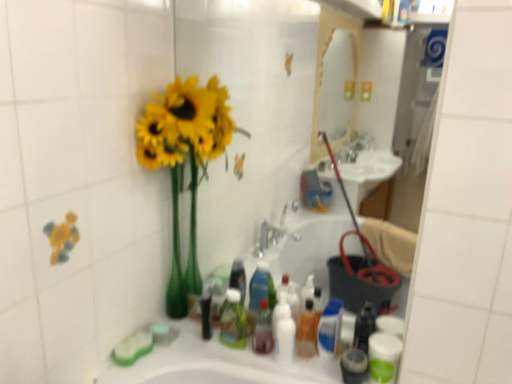
Locate an element on the screen. This screenshot has width=512, height=384. translucent plastic mouthwash at center, placed as the third mouthwash when sorted from right to left is located at coordinates (330, 328).

What do you see at coordinates (284, 334) in the screenshot?
I see `white glossy bottle at center, arranged as the 2th toiletry when viewed from the right` at bounding box center [284, 334].

This screenshot has height=384, width=512. I want to click on translucent plastic bottle at center, arranged as the first toiletry when viewed from the left, so click(233, 320).

The width and height of the screenshot is (512, 384). What do you see at coordinates (383, 356) in the screenshot? I see `white glossy mouthwash at lower right, marked as the first mouthwash in a right-to-left arrangement` at bounding box center [383, 356].

The image size is (512, 384). What do you see at coordinates (307, 331) in the screenshot?
I see `translucent plastic soap dispenser at center, the first toiletry from the right` at bounding box center [307, 331].

Find the location of a particular element. translucent plastic mouthwash at center, which is the second mouthwash in left-to-right order is located at coordinates (330, 328).

From a real-world perspective, between translucent plastic mouthwash at center, placed as the 4th mouthwash when sorted from right to left, and translucent plastic mouthwash at center, placed as the third mouthwash when sorted from right to left, who is vertically lower?

translucent plastic mouthwash at center, placed as the third mouthwash when sorted from right to left, is physically lower.

Consider the image. Is translucent plastic mouthwash at center, placed as the 4th mouthwash when sorted from right to left, inside the boundaries of translucent plastic mouthwash at center, placed as the third mouthwash when sorted from right to left, or outside?

translucent plastic mouthwash at center, placed as the 4th mouthwash when sorted from right to left, is spatially situated outside translucent plastic mouthwash at center, placed as the third mouthwash when sorted from right to left.

Which of these two, translucent plastic mouthwash at center, placed as the 4th mouthwash when sorted from right to left, or translucent plastic mouthwash at center, placed as the third mouthwash when sorted from right to left, is wider?

translucent plastic mouthwash at center, placed as the 4th mouthwash when sorted from right to left.

Between translucent plastic mouthwash at center, placed as the 4th mouthwash when sorted from right to left, and translucent plastic mouthwash at center, placed as the third mouthwash when sorted from right to left, which one is positioned in front?

translucent plastic mouthwash at center, placed as the 4th mouthwash when sorted from right to left, is in front.

Does point (256, 330) appear closer or farther from the camera than point (357, 351)?

Point (256, 330) is positioned farther from the camera compared to point (357, 351).

Can we say translucent plastic mouthwash at center, placed as the 4th mouthwash when sorted from right to left, lies outside translucent plastic mouthwash at lower right, the 2th mouthwash viewed from the right?

Yes, translucent plastic mouthwash at center, placed as the 4th mouthwash when sorted from right to left, is not within translucent plastic mouthwash at lower right, the 2th mouthwash viewed from the right.

From a real-world perspective, is translucent plastic mouthwash at center, placed as the 4th mouthwash when sorted from right to left, positioned above or below translucent plastic mouthwash at lower right, the 3th mouthwash viewed from the left?

Clearly, from a real-world perspective, translucent plastic mouthwash at center, placed as the 4th mouthwash when sorted from right to left, is above translucent plastic mouthwash at lower right, the 3th mouthwash viewed from the left.

Would you consider translucent plastic mouthwash at lower right, the 3th mouthwash viewed from the left, to be distant from white glossy bottle at center, arranged as the 2th toiletry when viewed from the right?

No, there isn't a large distance between translucent plastic mouthwash at lower right, the 3th mouthwash viewed from the left, and white glossy bottle at center, arranged as the 2th toiletry when viewed from the right.

From the image's perspective, which is above, translucent plastic mouthwash at lower right, the 2th mouthwash viewed from the right, or white glossy bottle at center, the 2th toiletry from the left?

white glossy bottle at center, the 2th toiletry from the left, from the image's perspective.

From a real-world perspective, is translucent plastic mouthwash at lower right, the 3th mouthwash viewed from the left, on white glossy bottle at center, arranged as the 2th toiletry when viewed from the right?

No.

Where is `the 2nd toiletry located above the translucent plastic mouthwash at lower right, the 3th mouthwash viewed from the left (from a real-world perspective)`? This screenshot has width=512, height=384. the 2nd toiletry located above the translucent plastic mouthwash at lower right, the 3th mouthwash viewed from the left (from a real-world perspective) is located at coordinates (284, 334).

From a real-world perspective, which object stands above the other?

In real-world perspective, translucent plastic soap dispenser at center, the third toiletry in the left-to-right sequence, is above.

Is translucent plastic soap dispenser at center, the first toiletry from the right, oriented towards translucent plastic mouthwash at lower right, the 3th mouthwash viewed from the left?

No, translucent plastic soap dispenser at center, the first toiletry from the right, is not aimed at translucent plastic mouthwash at lower right, the 3th mouthwash viewed from the left.

Looking at the image, does translucent plastic soap dispenser at center, the third toiletry in the left-to-right sequence, seem bigger or smaller compared to translucent plastic mouthwash at lower right, the 3th mouthwash viewed from the left?

In the image, translucent plastic soap dispenser at center, the third toiletry in the left-to-right sequence, appears to be larger than translucent plastic mouthwash at lower right, the 3th mouthwash viewed from the left.

Does translucent plastic soap dispenser at center, the first toiletry from the right, appear on the left side of translucent plastic mouthwash at lower right, the 3th mouthwash viewed from the left?

Yes.

Between point (389, 380) and point (352, 362), which one is positioned in front?

The point (389, 380) is in front.

Is white glossy mouthwash at lower right, marked as the first mouthwash in a right-to-left arrangement, oriented away from translucent plastic mouthwash at lower right, the 3th mouthwash viewed from the left?

No.

Which of these two, white glossy mouthwash at lower right, which is the 4th mouthwash in left-to-right order, or translucent plastic mouthwash at lower right, the 2th mouthwash viewed from the right, stands shorter?

translucent plastic mouthwash at lower right, the 2th mouthwash viewed from the right.

Between translucent plastic bottle at center, which is counted as the 3th toiletry, starting from the right, and white glossy mouthwash at lower right, which is the 4th mouthwash in left-to-right order, which one has larger size?

With larger size is white glossy mouthwash at lower right, which is the 4th mouthwash in left-to-right order.

Which object is closer to the camera taking this photo, translucent plastic bottle at center, arranged as the first toiletry when viewed from the left, or white glossy mouthwash at lower right, marked as the first mouthwash in a right-to-left arrangement?

white glossy mouthwash at lower right, marked as the first mouthwash in a right-to-left arrangement, is more forward.

Can you confirm if translucent plastic bottle at center, which is counted as the 3th toiletry, starting from the right, is positioned to the right of white glossy mouthwash at lower right, which is the 4th mouthwash in left-to-right order?

No.

Considering the points (228, 325) and (401, 347), which point is in front, point (228, 325) or point (401, 347)?

The point (401, 347) is closer to the camera.

From the image's perspective, is white glossy mouthwash at lower right, which is the 4th mouthwash in left-to-right order, above or below translucent plastic mouthwash at center, which is the second mouthwash in left-to-right order?

Clearly, from the image's perspective, white glossy mouthwash at lower right, which is the 4th mouthwash in left-to-right order, is below translucent plastic mouthwash at center, which is the second mouthwash in left-to-right order.

In terms of height, does white glossy mouthwash at lower right, which is the 4th mouthwash in left-to-right order, look taller or shorter compared to translucent plastic mouthwash at center, placed as the third mouthwash when sorted from right to left?

In the image, white glossy mouthwash at lower right, which is the 4th mouthwash in left-to-right order, appears to be shorter than translucent plastic mouthwash at center, placed as the third mouthwash when sorted from right to left.

From a real-world perspective, is white glossy mouthwash at lower right, which is the 4th mouthwash in left-to-right order, beneath translucent plastic mouthwash at center, placed as the third mouthwash when sorted from right to left?

Yes.

From a real-world perspective, starting from the translucent plastic mouthwash at center, placed as the 4th mouthwash when sorted from right to left, which mouthwash is the 1st one below it? Please provide its 2D coordinates.

[(330, 328)]

You are a GUI agent. You are given a task and a screenshot of the screen. Output one action in this format:
    pyautogui.click(x=<x>, y=<y>)
    Task: Click on the 2nd mouthwash counting from the right side of the translucent plastic mouthwash at center, placed as the 4th mouthwash when sorted from right to left
    The width and height of the screenshot is (512, 384).
    Given the screenshot: What is the action you would take?
    pyautogui.click(x=354, y=366)

Estimate the real-world distances between objects in this image. Which object is further from translucent plastic bottle at center, arranged as the first toiletry when viewed from the left, yellow matte vase at left or white glossy bottle at center, the 2th toiletry from the left?

yellow matte vase at left.

From the image, which object appears to be farther from translucent plastic mouthwash at center, placed as the 4th mouthwash when sorted from right to left, translucent plastic bottle at center, which is counted as the 3th toiletry, starting from the right, or yellow matte vase at left?

The object further to translucent plastic mouthwash at center, placed as the 4th mouthwash when sorted from right to left, is yellow matte vase at left.

Consider the image. From the image, which object appears to be nearer to white glossy bottle at center, the 2th toiletry from the left, translucent plastic mouthwash at center, placed as the third mouthwash when sorted from right to left, or white glossy mouthwash at lower right, marked as the first mouthwash in a right-to-left arrangement?

white glossy mouthwash at lower right, marked as the first mouthwash in a right-to-left arrangement, is closer to white glossy bottle at center, the 2th toiletry from the left.

Which object lies further to the anchor point white glossy mouthwash at lower right, marked as the first mouthwash in a right-to-left arrangement, translucent plastic mouthwash at lower right, the 2th mouthwash viewed from the right, or translucent plastic mouthwash at center, placed as the third mouthwash when sorted from right to left?

The object further to white glossy mouthwash at lower right, marked as the first mouthwash in a right-to-left arrangement, is translucent plastic mouthwash at center, placed as the third mouthwash when sorted from right to left.

Considering their positions, is translucent plastic mouthwash at center, which is the second mouthwash in left-to-right order, positioned further to translucent plastic mouthwash at lower right, the 2th mouthwash viewed from the right, than yellow matte vase at left?

translucent plastic mouthwash at center, which is the second mouthwash in left-to-right order, is further to translucent plastic mouthwash at lower right, the 2th mouthwash viewed from the right.

In the scene shown: Considering their positions, is white glossy mouthwash at lower right, marked as the first mouthwash in a right-to-left arrangement, positioned closer to translucent plastic mouthwash at lower right, the 3th mouthwash viewed from the left, than translucent plastic bottle at center, which is counted as the 3th toiletry, starting from the right?

Based on the image, white glossy mouthwash at lower right, marked as the first mouthwash in a right-to-left arrangement, appears to be nearer to translucent plastic mouthwash at lower right, the 3th mouthwash viewed from the left.

Based on their spatial positions, is translucent plastic soap dispenser at center, the third toiletry in the left-to-right sequence, or yellow matte vase at left closer to white glossy mouthwash at lower right, marked as the first mouthwash in a right-to-left arrangement?

translucent plastic soap dispenser at center, the third toiletry in the left-to-right sequence, lies closer to white glossy mouthwash at lower right, marked as the first mouthwash in a right-to-left arrangement, than the other object.

When comparing their distances from yellow matte vase at left, does translucent plastic bottle at center, arranged as the first toiletry when viewed from the left, or white glossy bottle at center, the 2th toiletry from the left, seem further?

white glossy bottle at center, the 2th toiletry from the left, is positioned further to the anchor yellow matte vase at left.

This screenshot has height=384, width=512. I want to click on toiletry between white glossy bottle at center, arranged as the 2th toiletry when viewed from the right, and translucent plastic mouthwash at lower right, the 2th mouthwash viewed from the right, so click(x=307, y=331).

Where is `mouthwash between translucent plastic bottle at center, arranged as the first toiletry when viewed from the left, and translucent plastic soap dispenser at center, the third toiletry in the left-to-right sequence, from left to right`? This screenshot has height=384, width=512. mouthwash between translucent plastic bottle at center, arranged as the first toiletry when viewed from the left, and translucent plastic soap dispenser at center, the third toiletry in the left-to-right sequence, from left to right is located at coordinates (263, 329).

This screenshot has width=512, height=384. I want to click on toiletry situated between translucent plastic mouthwash at center, placed as the 4th mouthwash when sorted from right to left, and translucent plastic soap dispenser at center, the third toiletry in the left-to-right sequence, from left to right, so click(284, 334).

This screenshot has height=384, width=512. What are the coordinates of `mouthwash between yellow matte vase at left and white glossy bottle at center, the 2th toiletry from the left, in the up-down direction` in the screenshot? It's located at (263, 329).